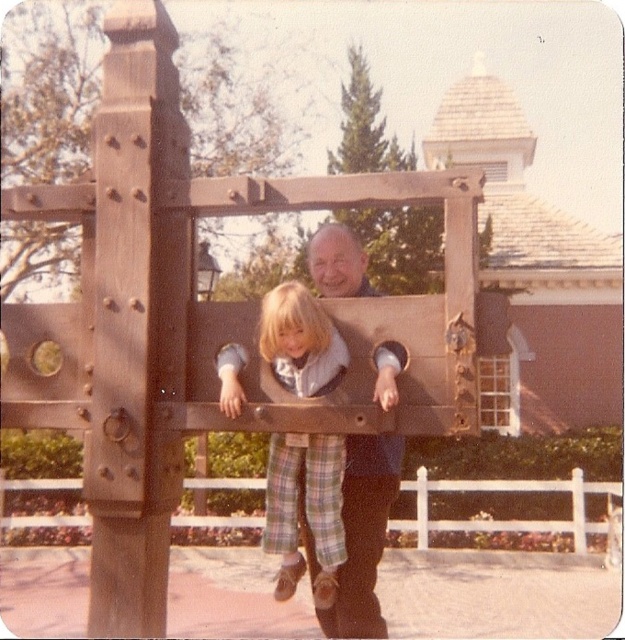
Based on the photo, you are designing a costume for a play and need to ensure the plaid pants at center and the matte brown wooden post at center are part of the set. Which item has a smaller width when viewed from the front?

The plaid pants at center is thinner than the matte brown wooden post at center, so the plaid pants at center has a smaller width when viewed from the front.

You are a photographer at the theme park and need to capture a photo of the plaid pants at center and the matte brown wooden post at center. Which object is positioned higher in the frame?

The plaid pants at center is above the matte brown wooden post at center, so it is positioned higher in the frame.